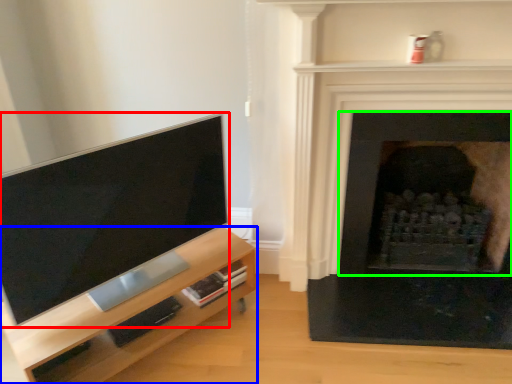
Question: Considering the real-world distances, which object is farthest from television (highlighted by a red box)? entertainment center (highlighted by a blue box) or fireplace (highlighted by a green box)?

Choices:
 (A) entertainment center
 (B) fireplace

Answer: (B)